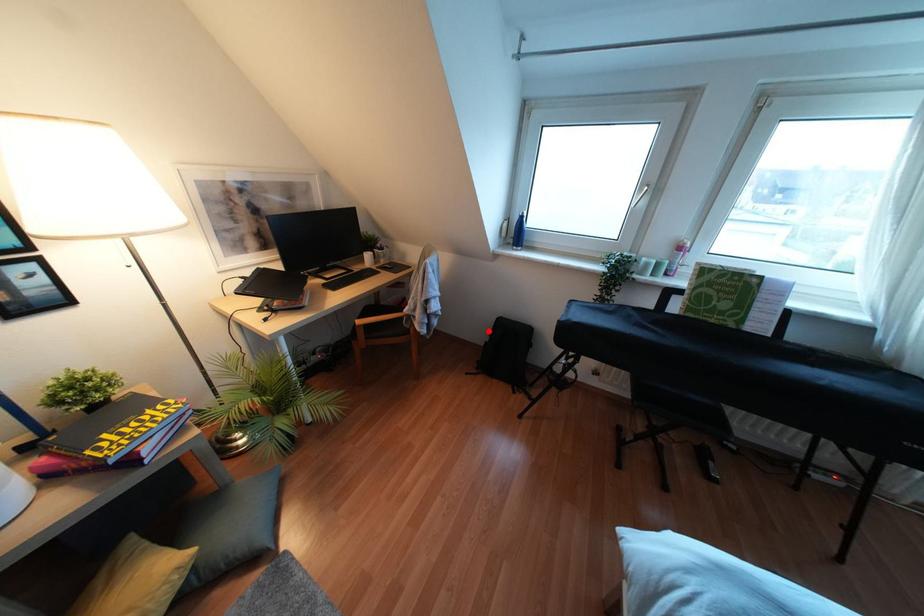
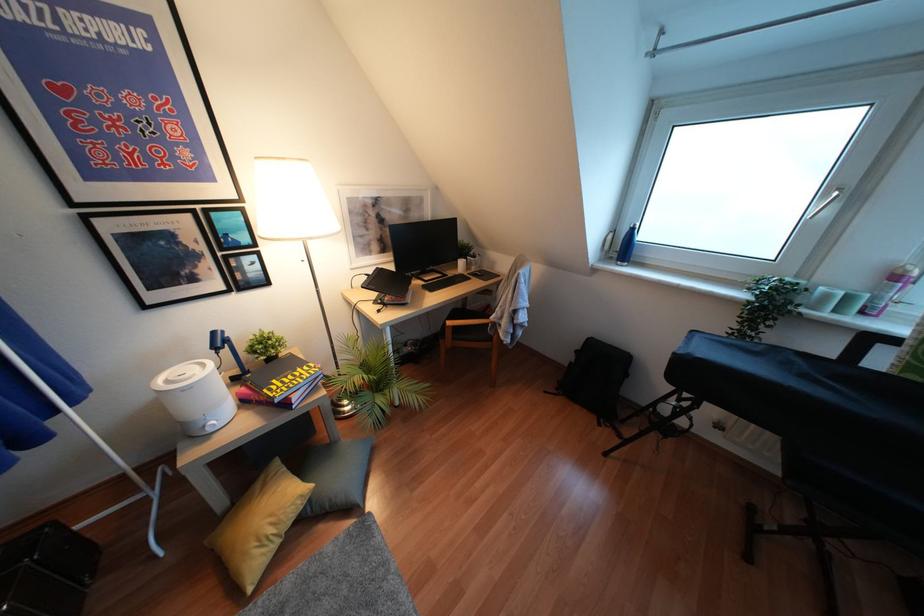
Question: A red point is marked in image1. In image2, is the corresponding 3D point closer to the camera or farther? Reply with the corresponding letter.

Choices:
 (A) The corresponding 3D point is closer.
 (B) The corresponding 3D point is farther.

Answer: (A)